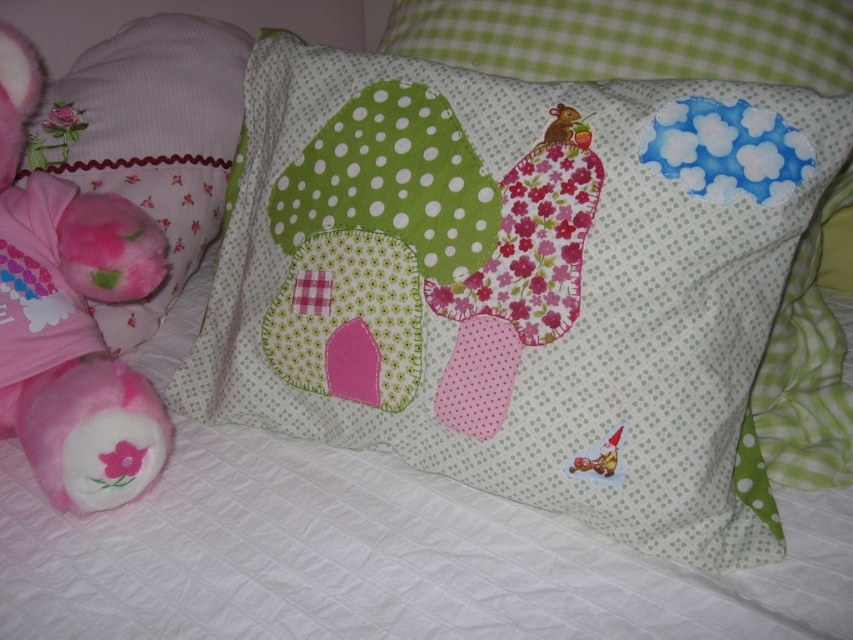
Question: Is fluffy pink plush at left thinner than green polka dot fabric at upper center?

Choices:
 (A) yes
 (B) no

Answer: (A)

Question: From the image, what is the correct spatial relationship of fluffy pink plush at left in relation to pink fabric pillow at left?

Choices:
 (A) below
 (B) above

Answer: (A)

Question: Which object appears farthest from the camera in this image?

Choices:
 (A) fluffy pink plush at left
 (B) green polka dot fabric at upper center

Answer: (B)

Question: Which point is farther to the camera?

Choices:
 (A) green polka dot fabric at upper center
 (B) pink fabric pillow at left

Answer: (B)

Question: Which point appears farthest from the camera in this image?

Choices:
 (A) (78, 326)
 (B) (79, 115)

Answer: (B)

Question: Is fluffy pink plush at left further to camera compared to green polka dot fabric at upper center?

Choices:
 (A) yes
 (B) no

Answer: (B)